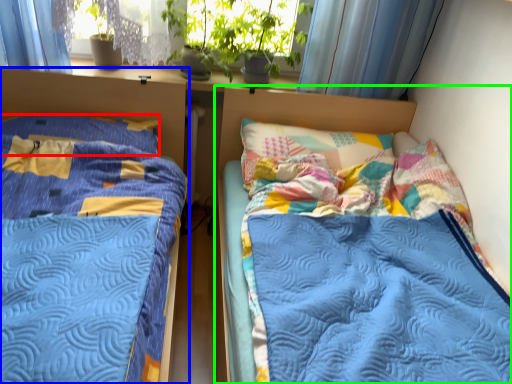
Question: Estimate the real-world distances between objects in this image. Which object is closer to pillow (highlighted by a red box), bed (highlighted by a blue box) or bed (highlighted by a green box)?

Choices:
 (A) bed
 (B) bed

Answer: (A)